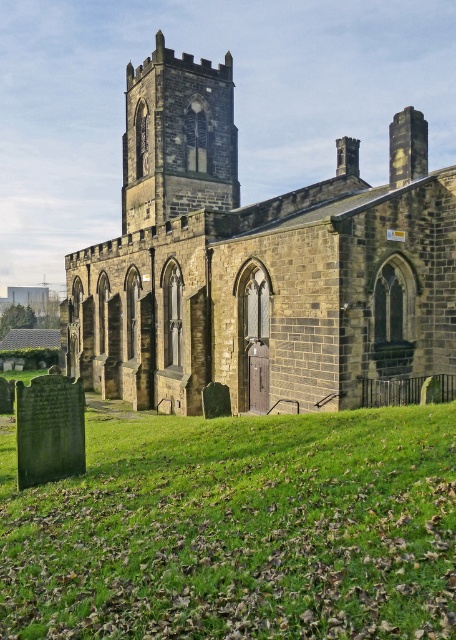
Which of these two, green grass at lower center or dark gray stone tower at center, stands shorter?

With less height is green grass at lower center.

Can you confirm if green grass at lower center is shorter than dark gray stone tower at center?

Yes, green grass at lower center is shorter than dark gray stone tower at center.

Measure the distance between point (88, 634) and camera.

Point (88, 634) is 9.35 meters away from camera.

You are a GUI agent. You are given a task and a screenshot of the screen. Output one action in this format:
    pyautogui.click(x=<x>, y=<y>)
    Task: Click on the green grass at lower center
    The height and width of the screenshot is (640, 456).
    Given the screenshot: What is the action you would take?
    pyautogui.click(x=238, y=531)

Which of these two, brown stone church at center or dark gray stone tower at center, stands shorter?

dark gray stone tower at center is shorter.

Can you confirm if brown stone church at center is wider than dark gray stone tower at center?

Yes.

Is point (67, 353) closer to camera compared to point (160, 144)?

No.

At what (x,y) coordinates should I click in order to perform the action: click on brown stone church at center. Please return your answer as a coordinate pair (x, y). Looking at the image, I should click on (258, 262).

Does green grass at lower center lie behind brown stone church at center?

No, green grass at lower center is closer to the viewer.

Is green grass at lower center taller than brown stone church at center?

No, green grass at lower center is not taller than brown stone church at center.

Between point (67, 588) and point (141, 301), which one is positioned in front?

Point (67, 588) is in front.

You are a GUI agent. You are given a task and a screenshot of the screen. Output one action in this format:
    pyautogui.click(x=<x>, y=<y>)
    Task: Click on the green grass at lower center
    The image size is (456, 640).
    Given the screenshot: What is the action you would take?
    pyautogui.click(x=238, y=531)